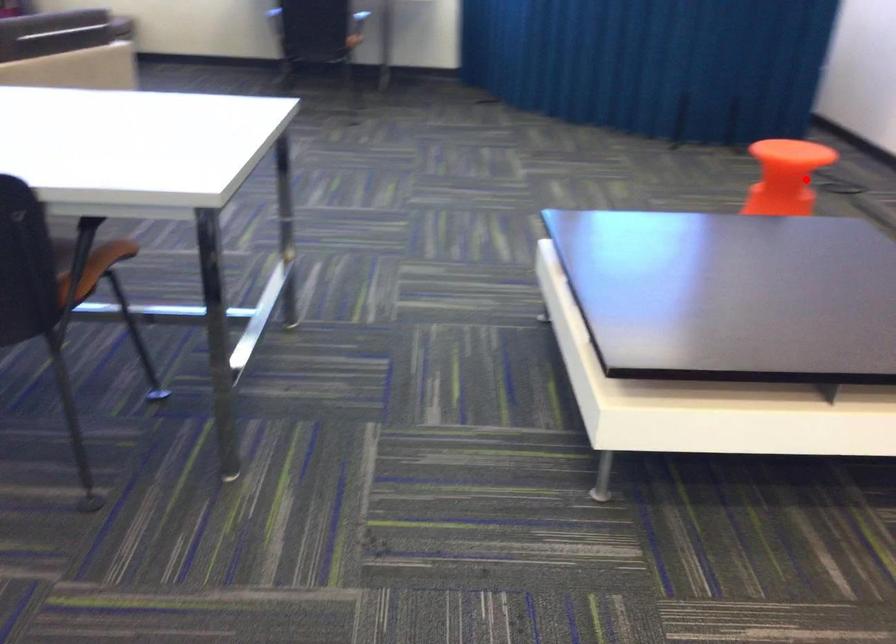
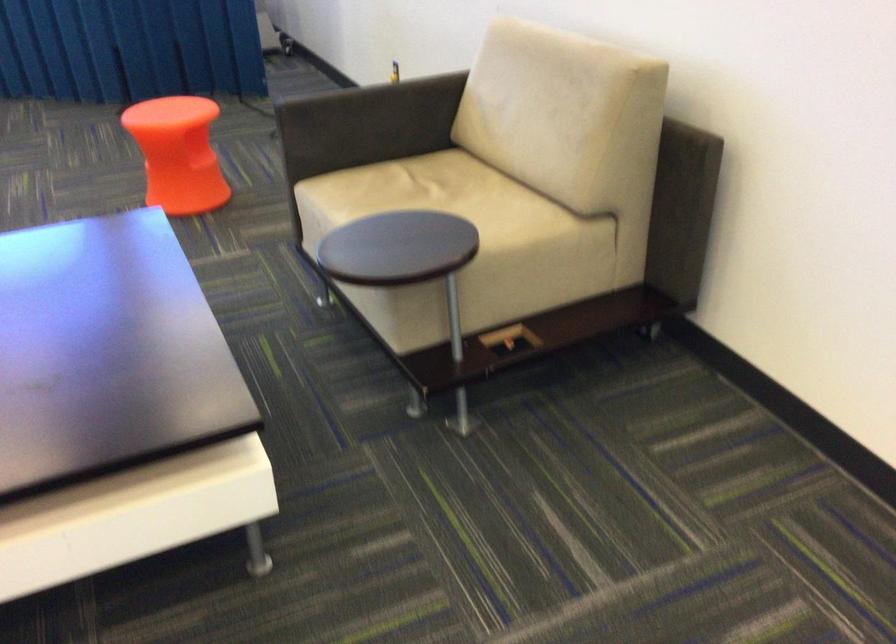
Find the pixel in the second image that matches the highlighted location in the first image.

(177, 154)